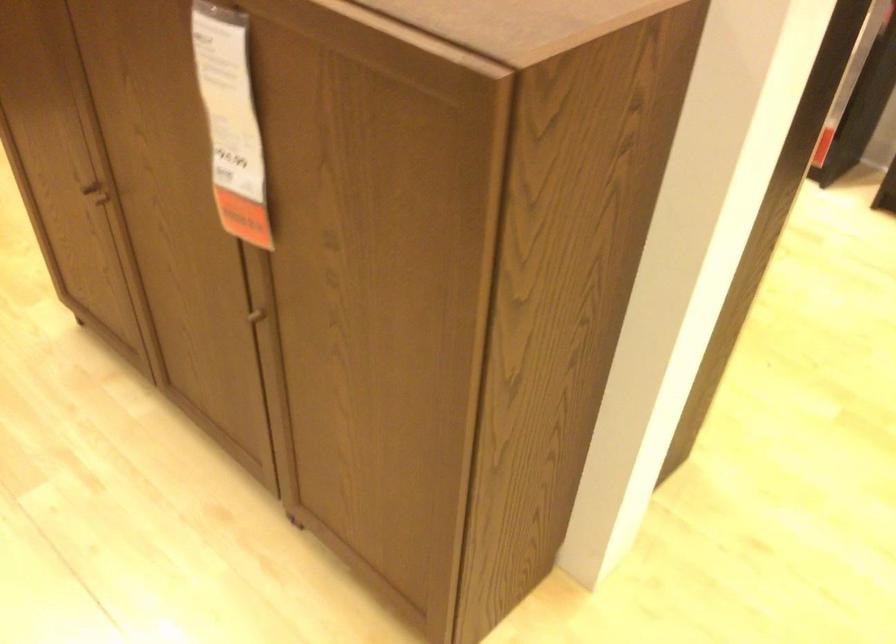
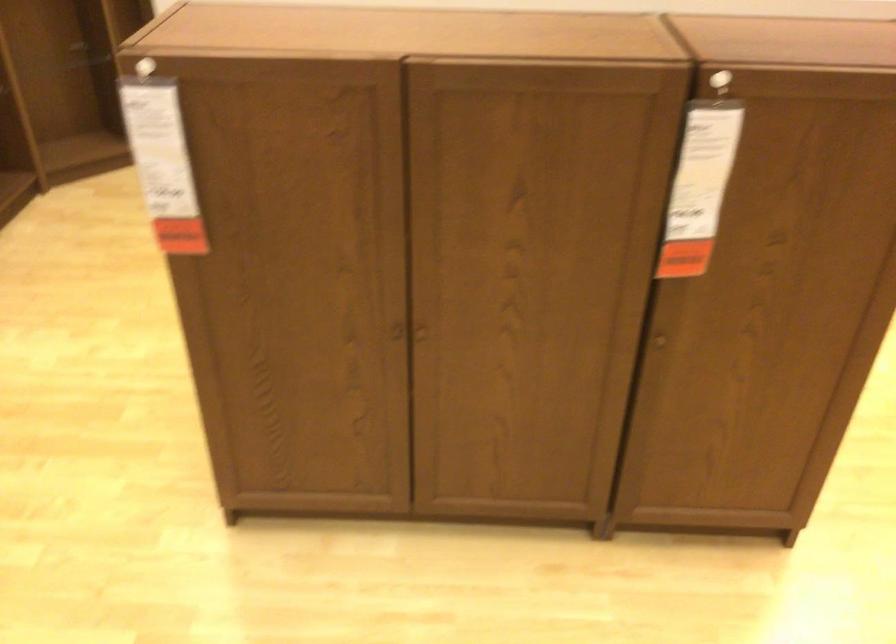
Locate, in the second image, the point that corresponds to [236,108] in the first image.

(702, 169)